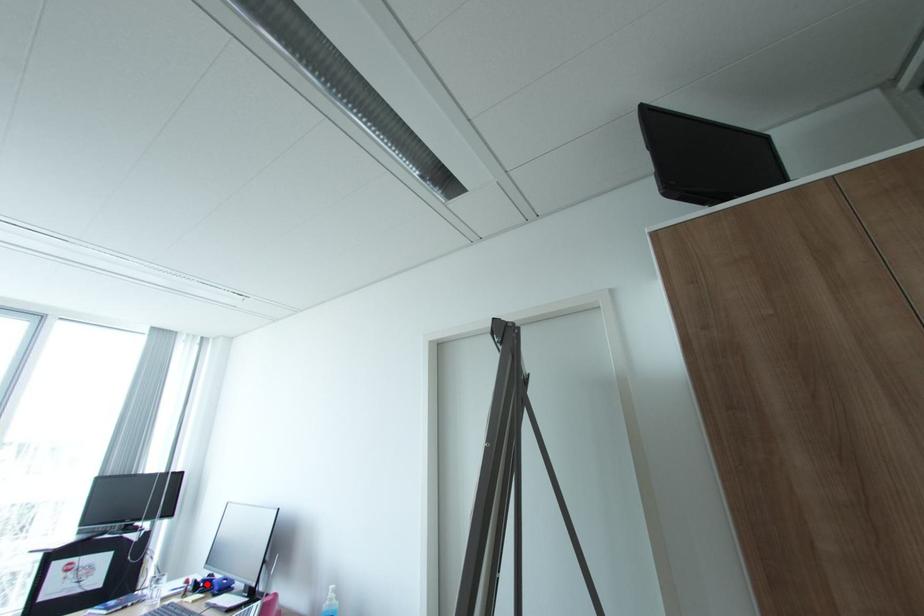
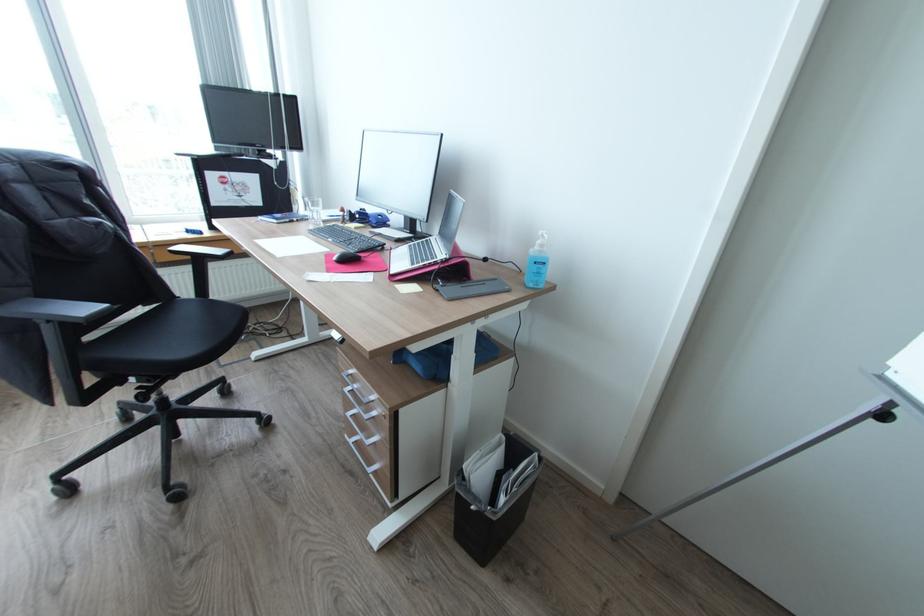
In the second image, find the point that corresponds to the highlighted location in the first image.

(362, 216)